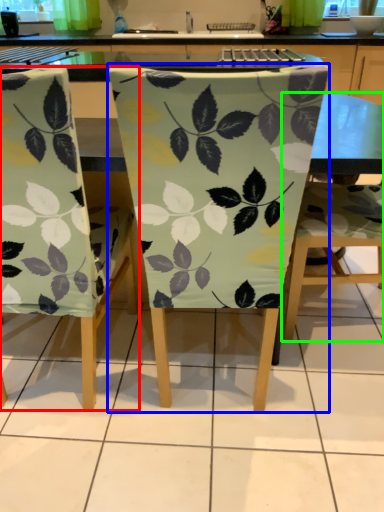
Question: Based on their relative distances, which object is nearer to chair (highlighted by a red box)? Choose from chair (highlighted by a blue box) and chair (highlighted by a green box).

Choices:
 (A) chair
 (B) chair

Answer: (A)